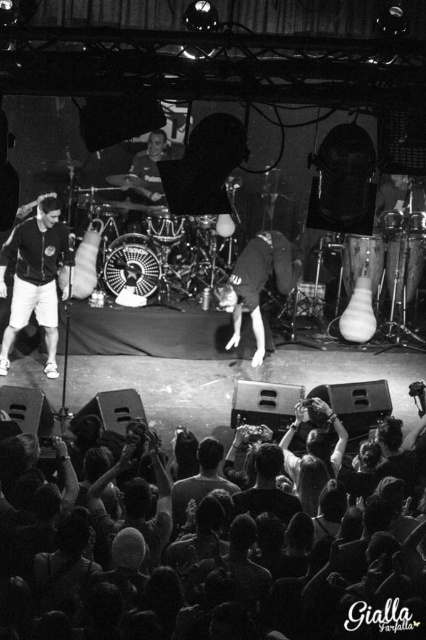
You are a photographer standing at the back of the venue. You want to take a photo of both the dark textured crowd at lower center and the black matte shorts at left in the same frame. Given that your camera has a 50mm lens, which has a field of view that can capture objects up to 4 meters apart, will you be able to include both subjects in your shot?

The dark textured crowd at lower center and black matte shorts at left are 3.94 meters apart from each other. Since the camera lens can capture up to 4 meters, you can include both subjects in the same frame.

You are a photographer positioned at the center of the venue. You want to capture a photo of the drummer on stage without the dark textured crowd at lower center blocking the view. Based on their positions, is this possible?

The dark textured crowd at lower center is located at point (233, 584), which is towards the lower center of the image. Since you are positioned at the center of the venue, you can adjust your angle or move slightly to avoid the crowd blocking the drummer on stage.

You are standing in the front row of the live music venue and notice two points marked in the scene. The first point is at coordinates point (58, 529) and the second is at point (29, 291). Which point is physically closer to your current position?

Point (58, 529) is closer to the viewer than point (29, 291), so the first point is physically closer to your current position.